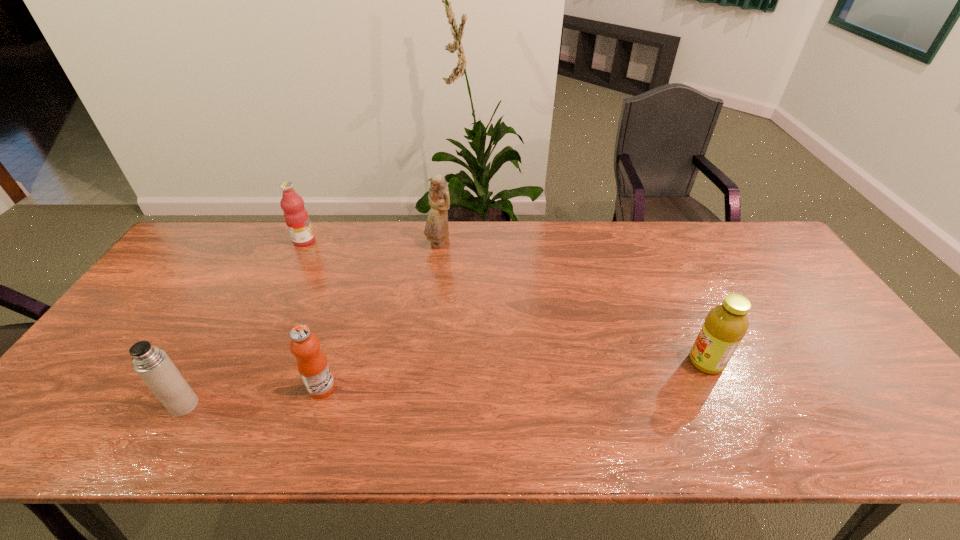
At what (x,y) coordinates should I click in order to perform the action: click on blank space located on the front label of the rightmost fruit juice. Please return your answer as a coordinate pair (x, y). This screenshot has height=540, width=960. Looking at the image, I should click on (541, 362).

I want to click on vacant space located on the front label of the rightmost fruit juice, so click(x=633, y=362).

Find the location of a particular element. This screenshot has height=540, width=960. vacant area located on the left of the leftmost object is located at coordinates (111, 406).

Find the location of a particular element. free spot located 0.240m on the front label of the second fruit juice from left to right is located at coordinates (436, 388).

What are the coordinates of `figurine located at the far edge` in the screenshot? It's located at (436, 229).

Where is `fruit juice present at the far edge`? fruit juice present at the far edge is located at coordinates (296, 217).

Where is `object that is at the near edge`? The image size is (960, 540). object that is at the near edge is located at coordinates (153, 365).

At what (x,y) coordinates should I click in order to perform the action: click on free spot at the far edge of the desktop. Please return your answer as a coordinate pair (x, y). The height and width of the screenshot is (540, 960). Looking at the image, I should click on (449, 223).

Identify the location of free region at the near edge of the desktop. The width and height of the screenshot is (960, 540). (719, 445).

Where is `free point at the left edge`? The width and height of the screenshot is (960, 540). free point at the left edge is located at coordinates (185, 289).